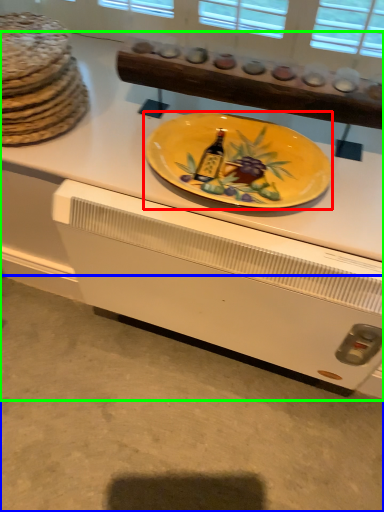
Question: Considering the real-world distances, which object is farthest from plate (highlighted by a red box)? concrete (highlighted by a blue box) or desk (highlighted by a green box)?

Choices:
 (A) concrete
 (B) desk

Answer: (A)